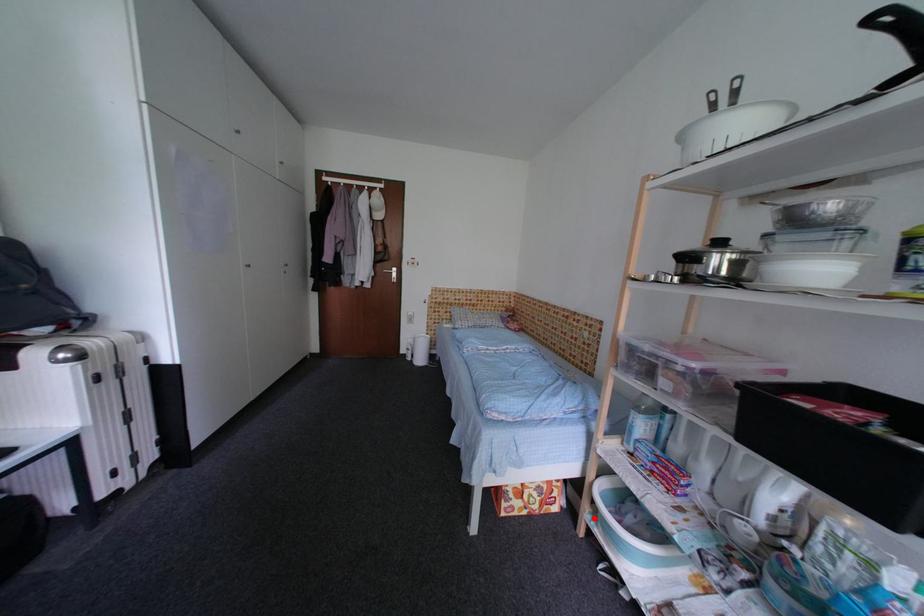
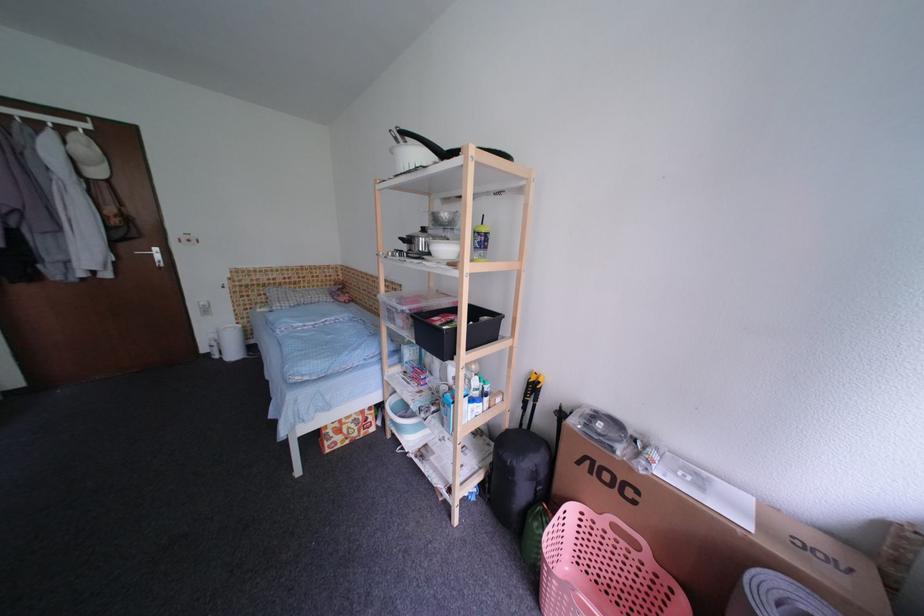
Find the pixel in the second image that matches the highlighted location in the first image.

(395, 426)